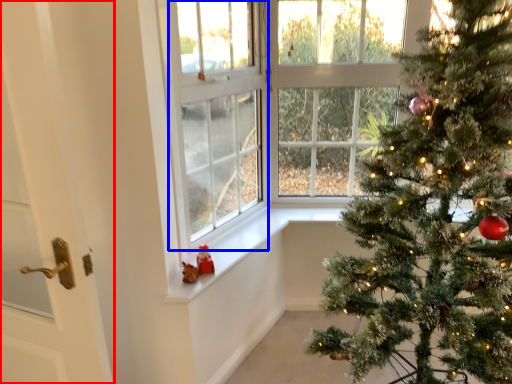
Question: Which object appears closest to the camera in this image, door (highlighted by a red box) or window screen (highlighted by a blue box)?

Choices:
 (A) door
 (B) window screen

Answer: (A)